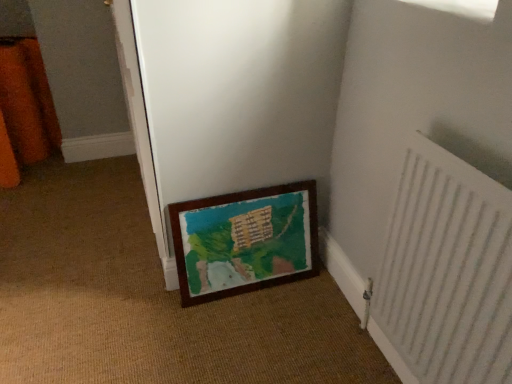
What are the coordinates of `unoccupied region to the right of wooden frame at lower center` in the screenshot? It's located at (311, 299).